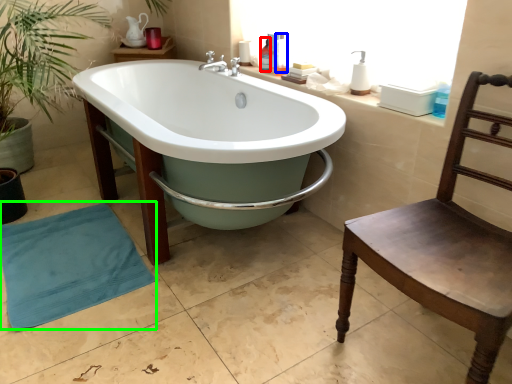
Question: Estimate the real-world distances between objects in this image. Which object is farther from toiletry (highlighted by a red box), toiletry (highlighted by a blue box) or beach towel (highlighted by a green box)?

Choices:
 (A) toiletry
 (B) beach towel

Answer: (B)